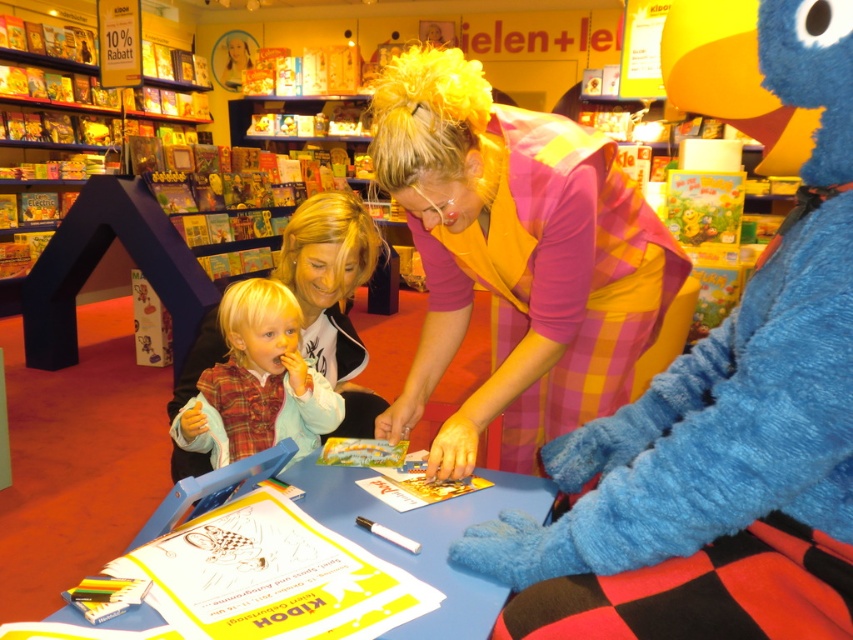
Looking at this image, can you confirm if plaid fabric shirt at center is positioned to the left of plaid wool sweater at lower left?

In fact, plaid fabric shirt at center is to the right of plaid wool sweater at lower left.

Looking at this image, is plaid fabric shirt at center positioned before plaid wool sweater at lower left?

Yes, plaid fabric shirt at center is closer to the viewer.

Identify the location of plaid fabric shirt at center. (515, 257).

This screenshot has height=640, width=853. I want to click on plaid fabric shirt at center, so pyautogui.click(x=515, y=257).

Which of these two, blue fuzzy glove at center or plaid wool sweater at lower left, stands taller?

blue fuzzy glove at center is taller.

Is blue fuzzy glove at center closer to camera compared to plaid wool sweater at lower left?

Yes, blue fuzzy glove at center is closer to the viewer.

Is point (815, 22) positioned before point (302, 365)?

Yes, it is.

The width and height of the screenshot is (853, 640). What are the coordinates of `blue fuzzy glove at center` in the screenshot? It's located at (718, 432).

Between point (647, 586) and point (399, 61), which one is positioned behind?

Positioned behind is point (399, 61).

Is point (793, 490) more distant than point (467, 234)?

No, (793, 490) is closer to viewer.

Image resolution: width=853 pixels, height=640 pixels. Identify the location of blue fuzzy glove at center. (718, 432).